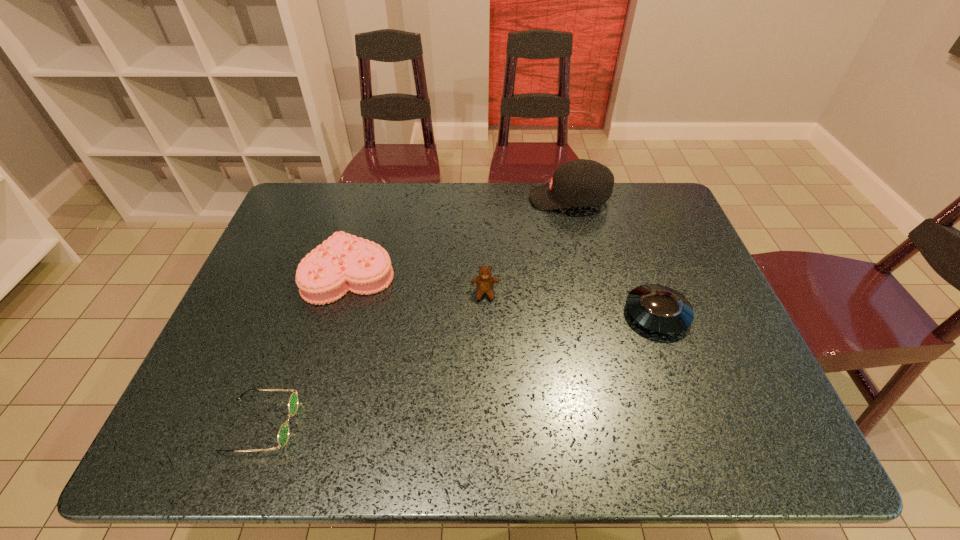
You are a GUI agent. You are given a task and a screenshot of the screen. Output one action in this format:
    pyautogui.click(x=<x>, y=<y>)
    Task: Click on the vacant space that satisfies the following two spatial constraints: 1. with a logo on the front of the second shortest object; 2. on the left side of the tallest object
    The width and height of the screenshot is (960, 540).
    Given the screenshot: What is the action you would take?
    pyautogui.click(x=596, y=314)

At what (x,y) coordinates should I click in order to perform the action: click on vacant region that satisfies the following two spatial constraints: 1. at the face of the teddy bear; 2. on the lenses of the spectacles. Please return your answer as a coordinate pair (x, y). Looking at the image, I should click on [x=487, y=424].

Locate an element on the screen. This screenshot has height=540, width=960. vacant area that satisfies the following two spatial constraints: 1. with a logo on the front of the tallest object; 2. at the face of the third object from right to left is located at coordinates (591, 293).

I want to click on vacant space that satisfies the following two spatial constraints: 1. at the face of the third object from left to right; 2. on the lenses of the nearest object, so click(x=487, y=424).